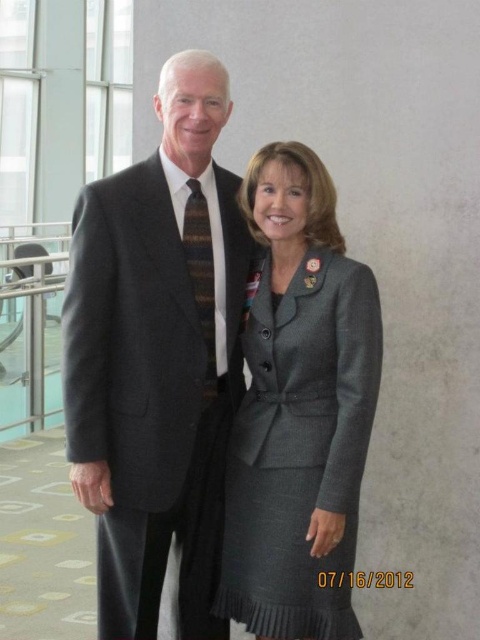
Is dark gray suit at center to the right of gray wool suit at center from the viewer's perspective?

In fact, dark gray suit at center is to the left of gray wool suit at center.

Looking at this image, does dark gray suit at center lie in front of gray wool suit at center?

No, it is not.

Which is in front, point (235, 232) or point (276, 630)?

Positioned in front is point (276, 630).

You are a GUI agent. You are given a task and a screenshot of the screen. Output one action in this format:
    pyautogui.click(x=<x>, y=<y>)
    Task: Click on the dark gray suit at center
    The width and height of the screenshot is (480, 640).
    Given the screenshot: What is the action you would take?
    pyautogui.click(x=157, y=356)